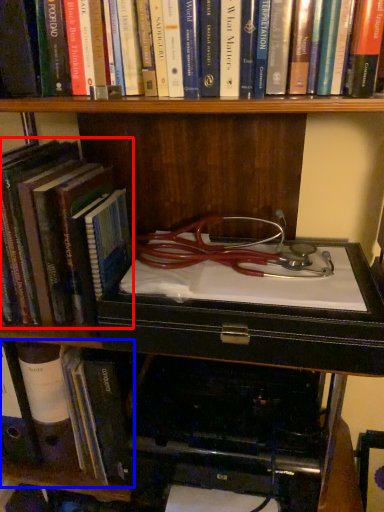
Question: Which object appears closest to the camera in this image, book (highlighted by a red box) or book (highlighted by a blue box)?

Choices:
 (A) book
 (B) book

Answer: (A)